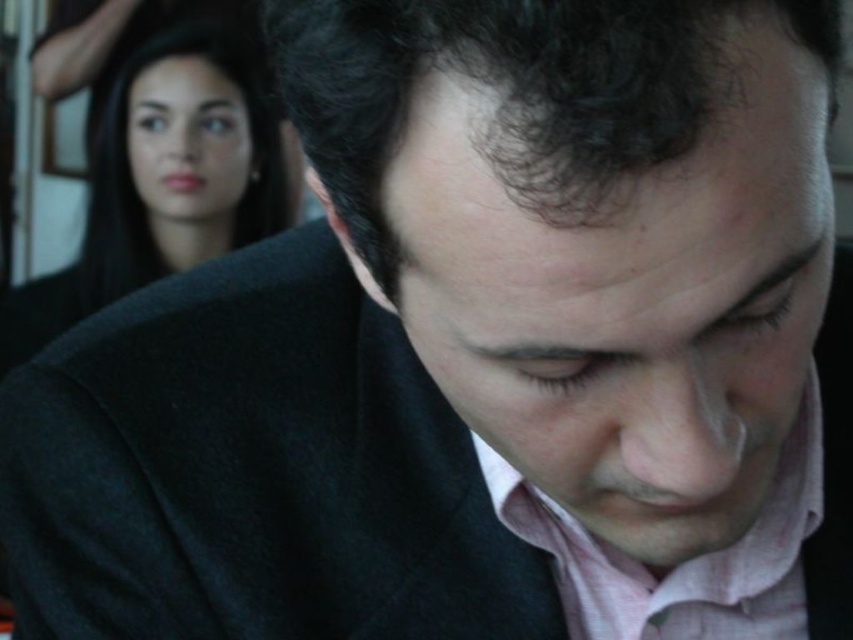
You are an interior designer assessing the spatial arrangement of the scene. Considering the sizes of the smooth black hair at upper left and the pink textured dress shirt at center, which object would require more space in a layout design?

The smooth black hair at upper left is bigger than the pink textured dress shirt at center, so it would require more space in a layout design.